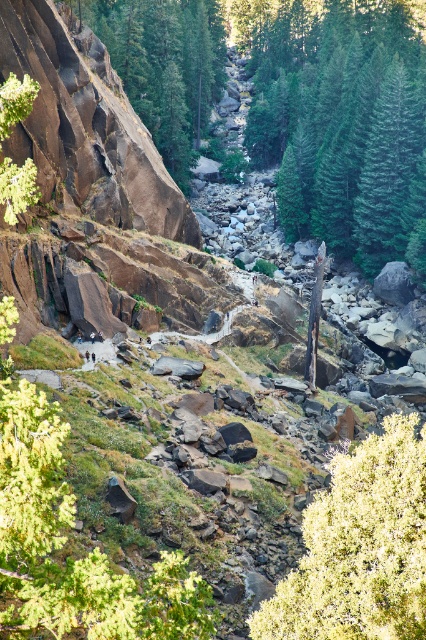
Question: Does green fuzzy bush at lower right appear over brown rough rock at left?

Choices:
 (A) no
 (B) yes

Answer: (A)

Question: Which object is the closest to the green fuzzy bush at lower right?

Choices:
 (A) green textured tree at center
 (B) brown rough rock at left

Answer: (B)

Question: Which point is closer to the camera?

Choices:
 (A) green fuzzy bush at lower right
 (B) green textured tree at center

Answer: (A)

Question: Is green textured tree at center bigger than brown rough rock at left?

Choices:
 (A) no
 (B) yes

Answer: (B)

Question: Which is farther from the green fuzzy bush at lower right?

Choices:
 (A) green textured tree at center
 (B) brown rough rock at left

Answer: (A)

Question: Can you confirm if green fuzzy bush at lower right is wider than brown rough rock at left?

Choices:
 (A) yes
 (B) no

Answer: (B)